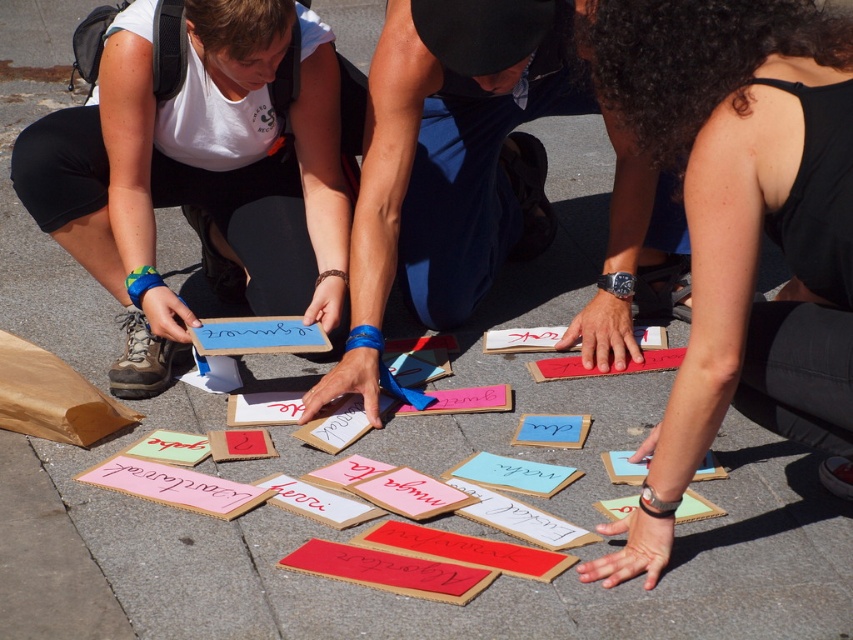
You are a pedestrian passing by the group. You see the black fabric at center and the cardboard sign at center. Which object is closer to your right side?

The black fabric at center is to the right of the cardboard sign at center, so the black fabric at center is closer to your right side.

You are a pedestrian passing by the group working with the white matte paper at center and the cardboard sign at center. Based on their sizes, which object would you estimate is more likely to be used as a base for writing or drawing? Explain your reasoning.

The cardboard sign at center is larger than the white matte paper at center, so it is more likely to be used as a base for writing or drawing since larger surfaces are typically better suited for such activities.

You are a pedestrian passing by the group. You notice the black fabric at center and the cardboard sign at center. Which one is taller?

The black fabric at center is much taller than the cardboard sign at center.